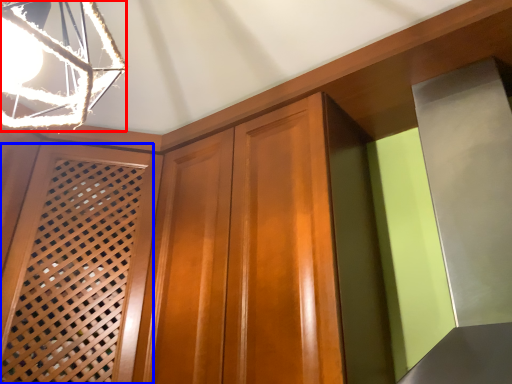
Question: Which object appears closest to the camera in this image, lamp (highlighted by a red box) or screen door (highlighted by a blue box)?

Choices:
 (A) lamp
 (B) screen door

Answer: (A)